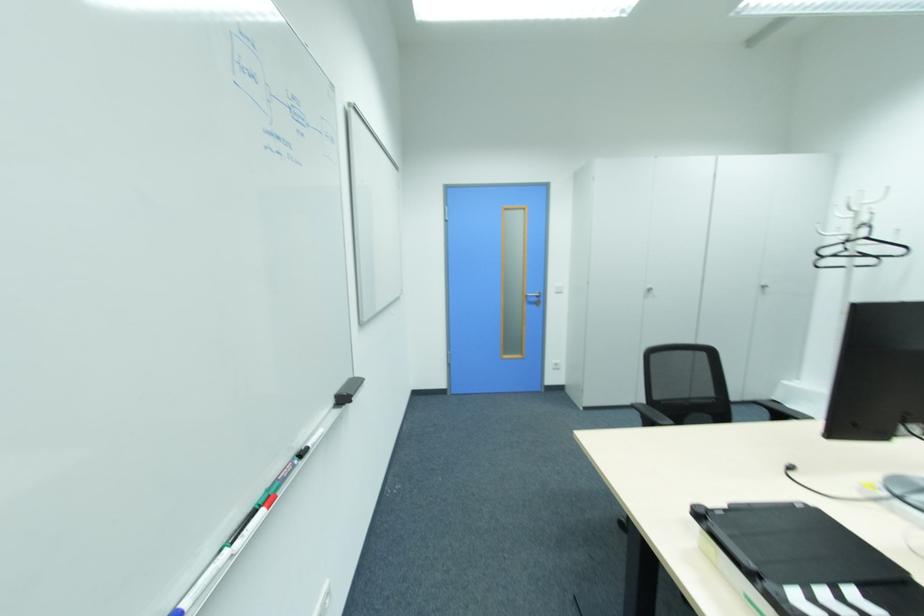
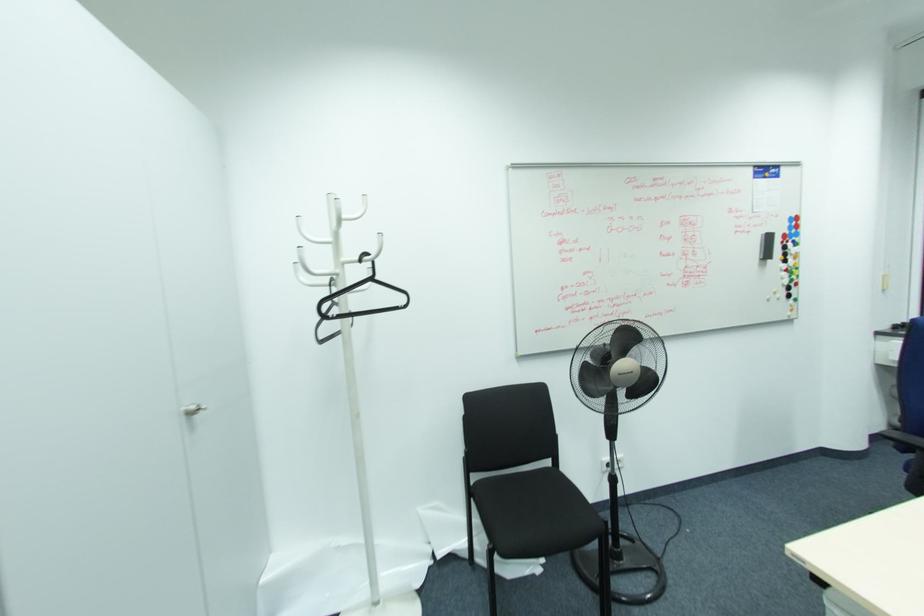
Locate, in the second image, the point that corresponds to the point at 865,238 in the first image.

(371, 280)